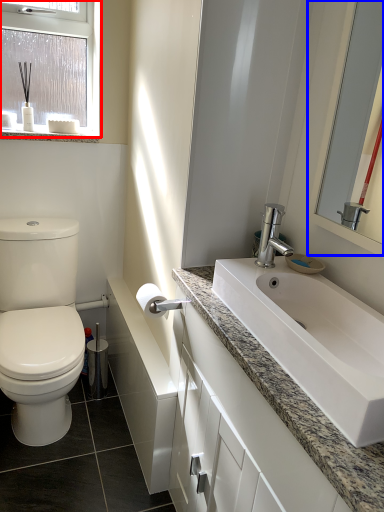
Question: Which object is closer to the camera taking this photo, window (highlighted by a red box) or mirror (highlighted by a blue box)?

Choices:
 (A) window
 (B) mirror

Answer: (B)